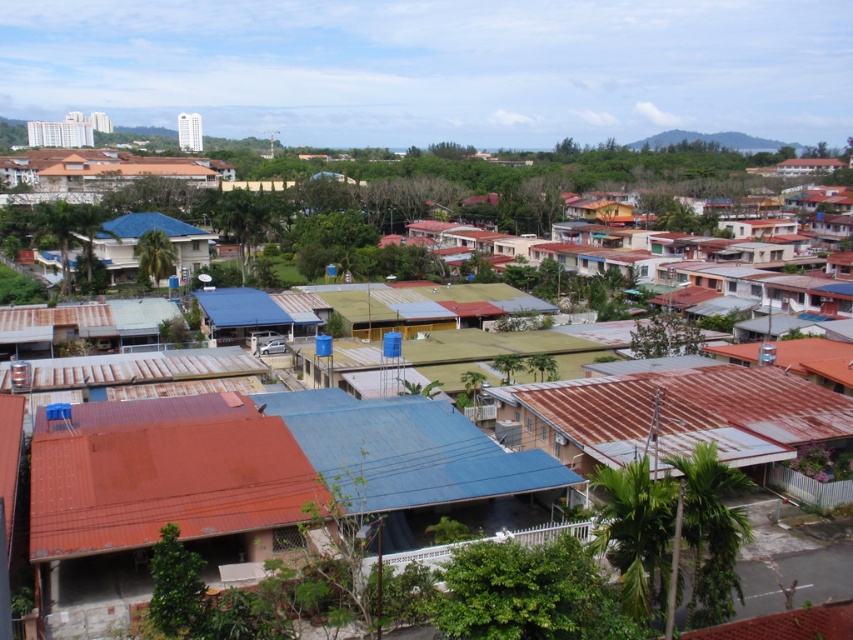
Question: Which of the following is the closest to the observer?

Choices:
 (A) rusty corrugated metal hut at lower left
 (B) blue matte house at center

Answer: (A)

Question: Is rusty metal hut at lower right positioned at the back of blue matte house at center?

Choices:
 (A) no
 (B) yes

Answer: (A)

Question: Among these points, which one is farthest from the camera?

Choices:
 (A) (537, 385)
 (B) (291, 547)
 (C) (157, 214)

Answer: (C)

Question: Can you confirm if rusty corrugated metal hut at lower left is positioned to the left of blue matte house at center?

Choices:
 (A) no
 (B) yes

Answer: (A)

Question: Is rusty corrugated metal hut at lower left to the left of rusty metal hut at lower right from the viewer's perspective?

Choices:
 (A) yes
 (B) no

Answer: (A)

Question: Based on their relative distances, which object is nearer to the rusty metal hut at lower right?

Choices:
 (A) rusty corrugated metal hut at lower left
 (B) blue matte house at center

Answer: (A)